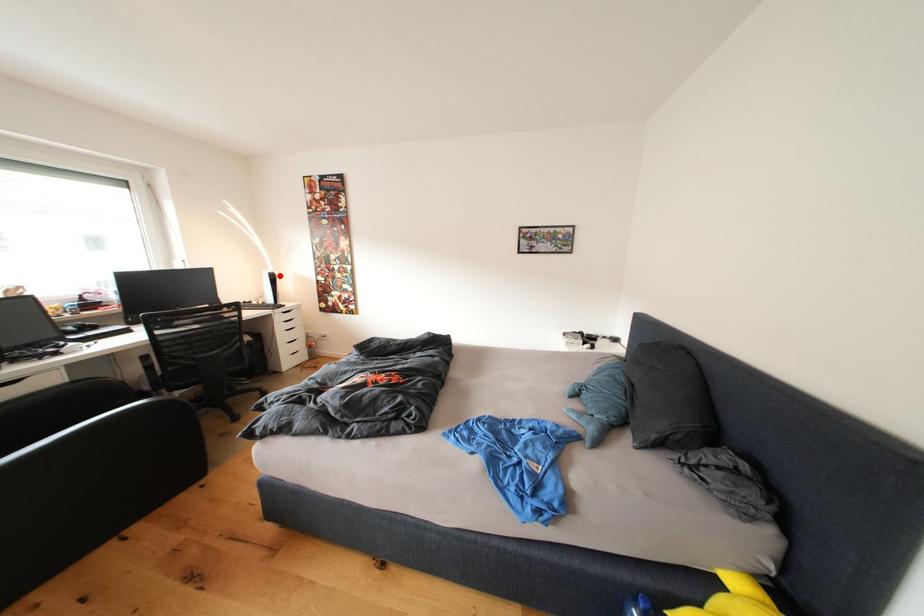
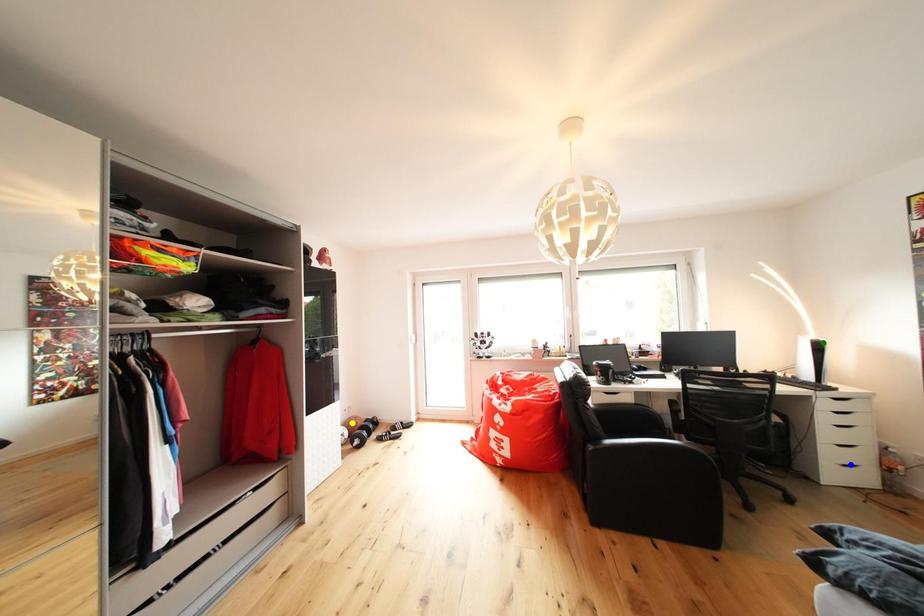
Question: I am providing you with two images of the same scene from different viewpoints. A red point is marked on the first image. You are given multiple points on the second image. Which point in image 2 represents the same 3d spot as the red point in image 1?

Choices:
 (A) green point
 (B) yellow point
 (C) blue point

Answer: (A)